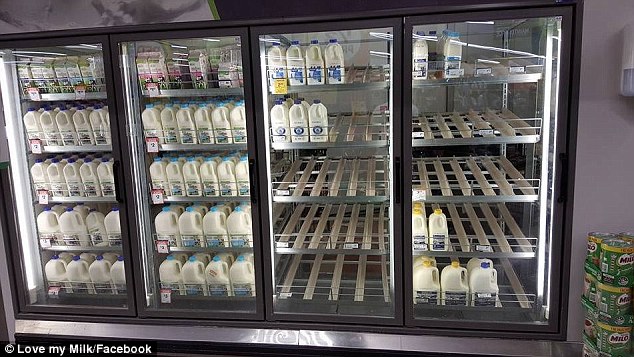
You are a GUI agent. You are given a task and a screenshot of the screen. Output one action in this format:
    pyautogui.click(x=<x>, y=<y>)
    Task: Click on the glass door
    
    Given the screenshot: What is the action you would take?
    pyautogui.click(x=111, y=204), pyautogui.click(x=158, y=210), pyautogui.click(x=300, y=210), pyautogui.click(x=491, y=196)